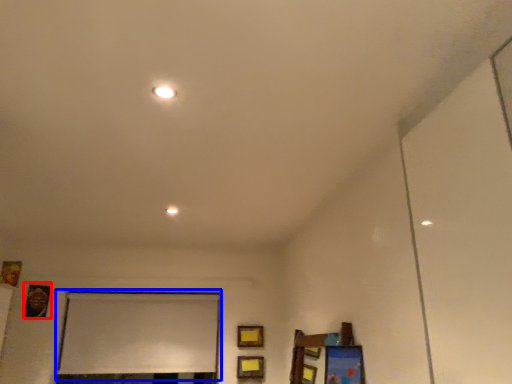
Question: Which of the following is the farthest to the observer, picture frame (highlighted by a red box) or window screen (highlighted by a blue box)?

Choices:
 (A) picture frame
 (B) window screen

Answer: (B)